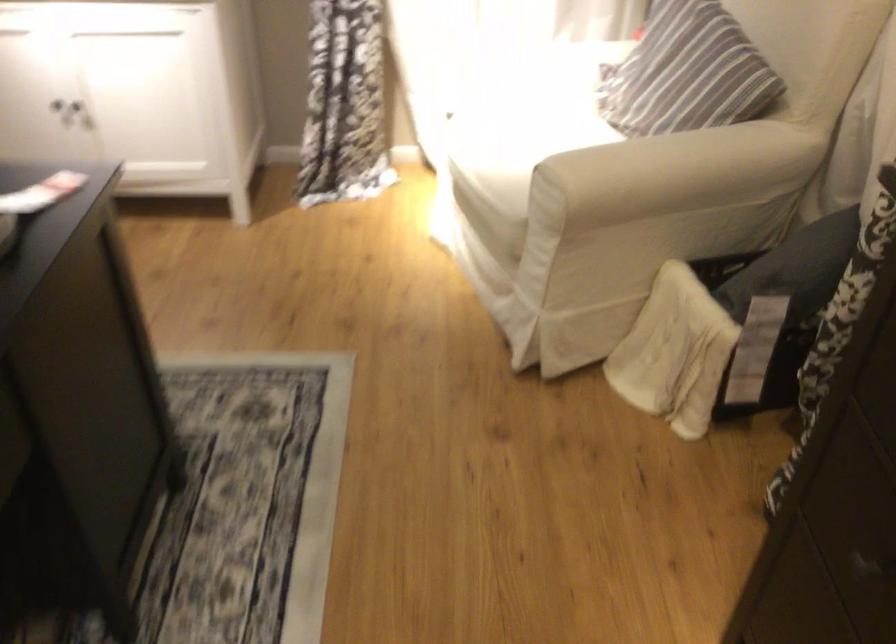
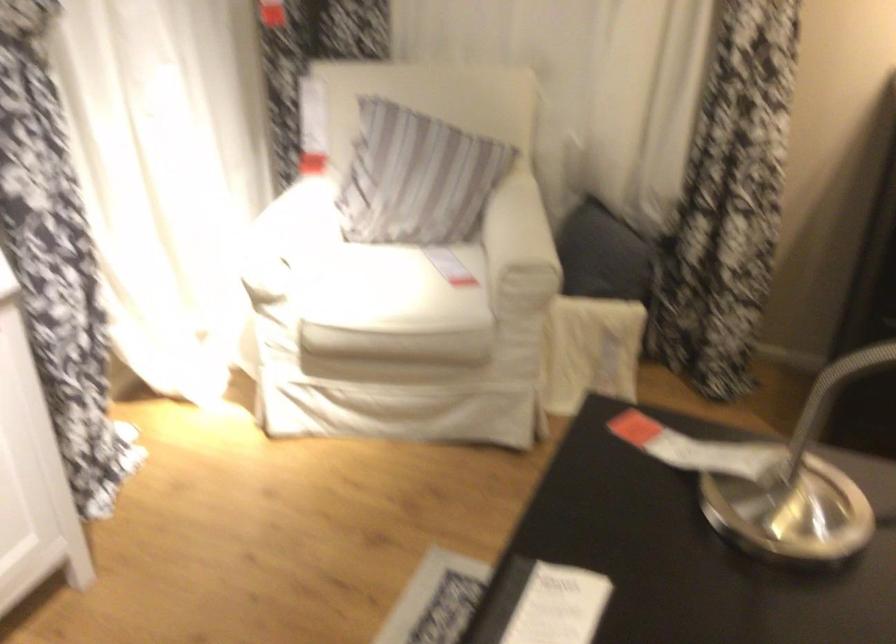
In the second image, find the point that corresponds to pixel 666 71 in the first image.

(416, 178)